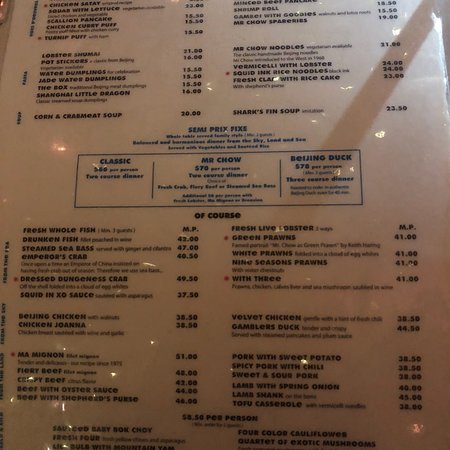
At what (x,y) coordinates should I click in order to perform the action: click on dark blue divider line. Please return your answer as a coordinate pair (x, y). Image resolution: width=450 pixels, height=450 pixels. Looking at the image, I should click on (152, 170), (280, 169).